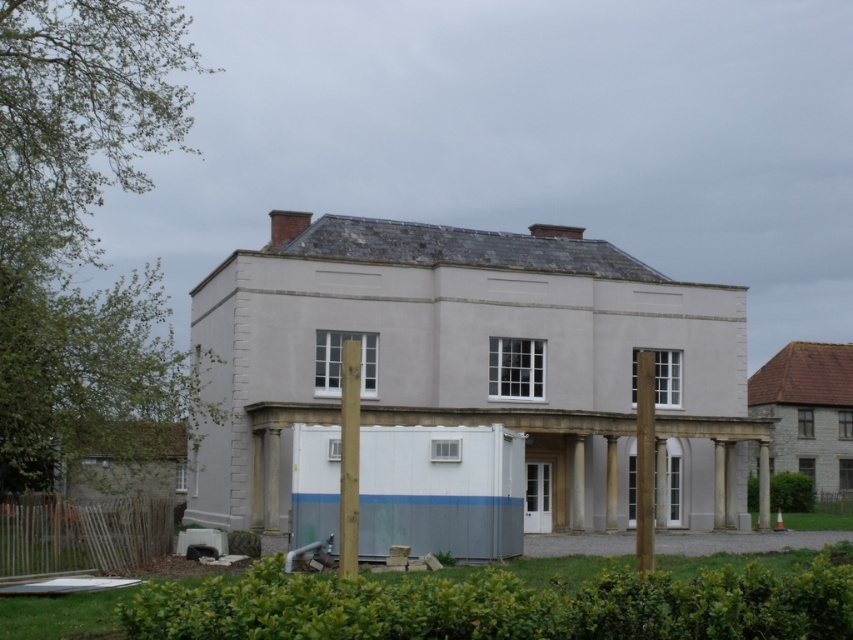
Question: Does brown wooden post at right appear on the left side of white smooth pillar at center?

Choices:
 (A) no
 (B) yes

Answer: (A)

Question: In this image, where is white stone pillar at center located relative to white stone column at center?

Choices:
 (A) right
 (B) left

Answer: (B)

Question: Can you confirm if green leafy hedge at lower center is positioned above wooden post at center?

Choices:
 (A) yes
 (B) no

Answer: (B)

Question: Estimate the real-world distances between objects in this image. Which object is farther from the brown wooden post at right?

Choices:
 (A) green leafy hedge at lower center
 (B) green leafy hedge at right

Answer: (B)

Question: Which object appears farthest from the camera in this image?

Choices:
 (A) green leafy hedge at lower center
 (B) white stone column at center
 (C) green leafy hedge at right
 (D) white stone pillar at center

Answer: (C)

Question: Which of the following is the closest to the observer?

Choices:
 (A) green leafy hedge at right
 (B) white stone column at center
 (C) green leafy hedge at lower center
 (D) wooden post at center

Answer: (C)